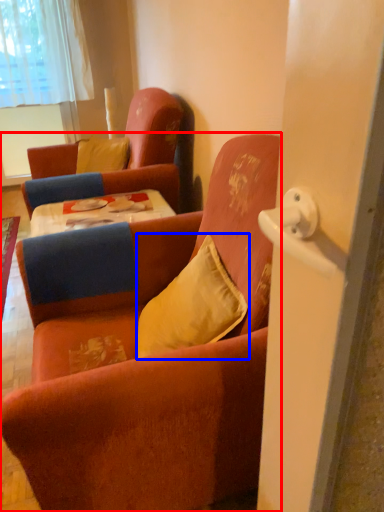
Question: Which object appears closest to the camera in this image, chair (highlighted by a red box) or pillow (highlighted by a blue box)?

Choices:
 (A) chair
 (B) pillow

Answer: (A)